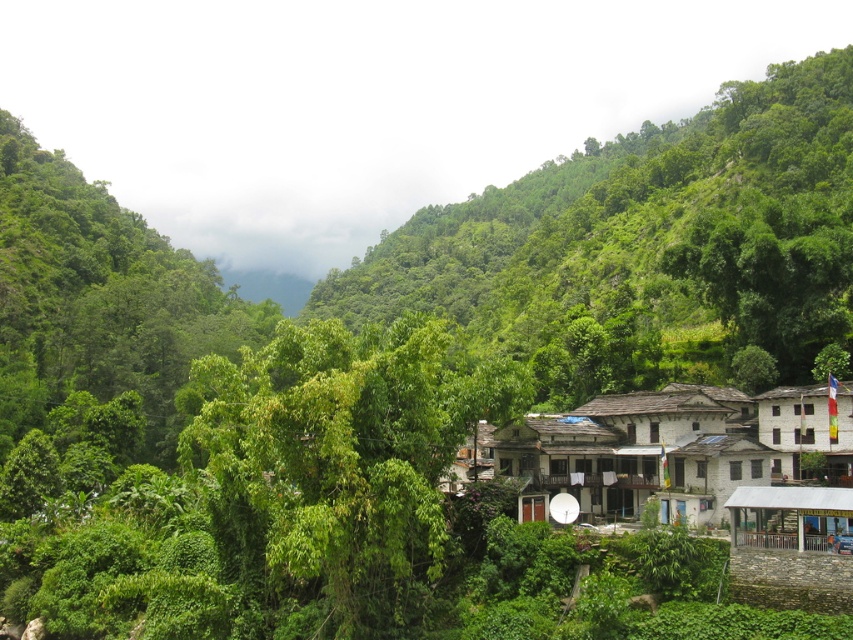
You are standing in the mountain village and want to take a photo. There are two points of interest marked as point 1 at coordinates (627,440) and point 2 at coordinates (780,486). Which point should you focus on first if you want to capture the closest object in your shot?

Point 1 at coordinates (627,440) is closer to the camera than point 2 at coordinates (780,486), so you should focus on point 1 first to capture the closest object.

You are standing at the point marked by the coordinate point (645, 248) in the image. What do you see directly in front of you?

You see a green leafy tree at center directly in front of you at the coordinate point (645, 248).